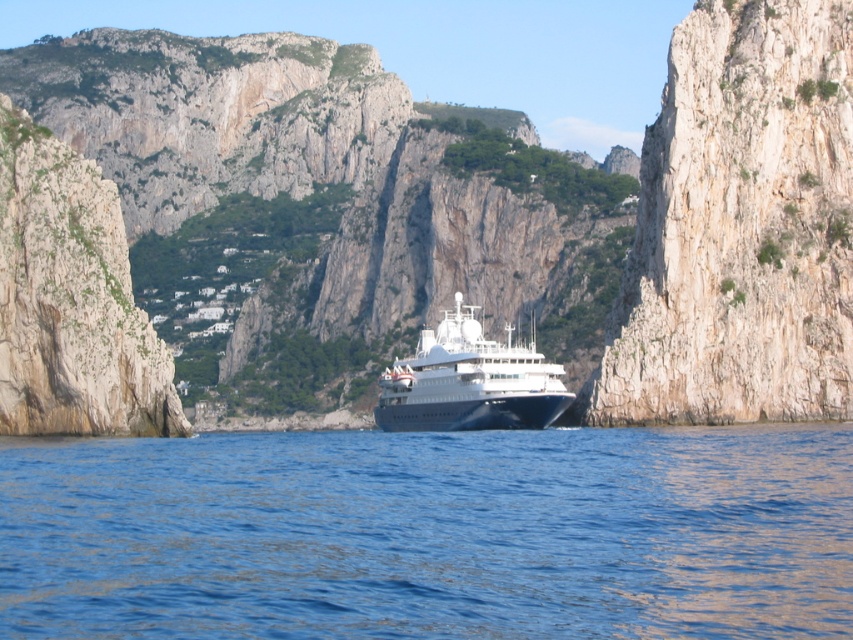
From the picture: Can you confirm if white stone mountain at center is thinner than white glossy cruise ship at center?

No.

Can you confirm if white stone mountain at center is taller than white glossy cruise ship at center?

Yes, white stone mountain at center is taller than white glossy cruise ship at center.

Identify the location of white stone mountain at center. (430, 221).

Does blue liquid water at center have a larger size compared to white glossy cruise ship at center?

Incorrect, blue liquid water at center is not larger than white glossy cruise ship at center.

Can you confirm if blue liquid water at center is smaller than white glossy cruise ship at center?

Correct, blue liquid water at center occupies less space than white glossy cruise ship at center.

The width and height of the screenshot is (853, 640). Identify the location of blue liquid water at center. (431, 534).

From the picture: Can you confirm if white stone mountain at center is shorter than blue liquid water at center?

No.

This screenshot has width=853, height=640. Describe the element at coordinates (430, 221) in the screenshot. I see `white stone mountain at center` at that location.

Between point (775, 40) and point (561, 458), which one is positioned in front?

Point (561, 458)

Where is `white stone mountain at center`? This screenshot has height=640, width=853. white stone mountain at center is located at coordinates (430, 221).